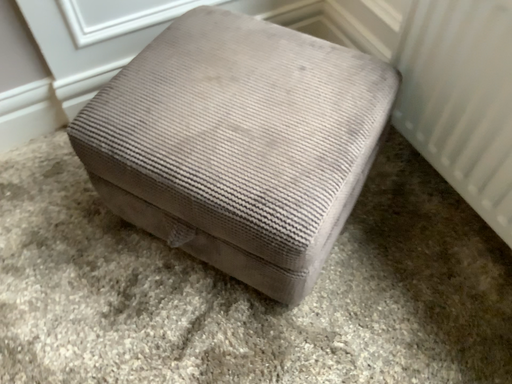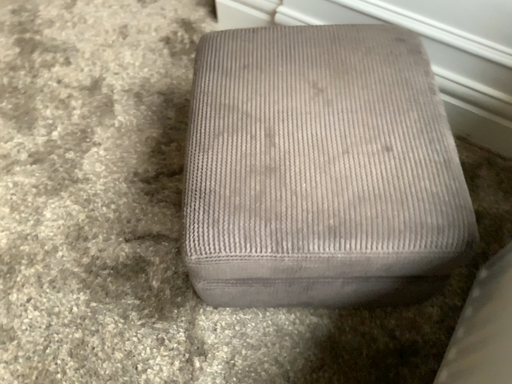
Question: Which way did the camera rotate in the video?

Choices:
 (A) rotated downward
 (B) rotated upward

Answer: (B)